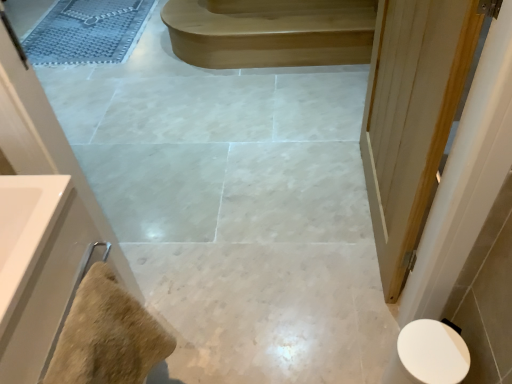
Question: Is white glossy sink at left to the left or to the right of light brown wood stair at upper center in the image?

Choices:
 (A) right
 (B) left

Answer: (B)

Question: From a real-world perspective, is white glossy sink at left physically located above or below light brown wood stair at upper center?

Choices:
 (A) below
 (B) above

Answer: (B)

Question: Based on their relative distances, which object is farther from the textured gray bath mat at upper left?

Choices:
 (A) light brown wood stair at upper center
 (B) beige textured towel at lower left
 (C) white glossy toilet at lower right
 (D) white wood door at right
 (E) white glossy sink at left

Answer: (C)

Question: Which object is the farthest from the light brown wood stair at upper center?

Choices:
 (A) white glossy sink at left
 (B) white wood door at right
 (C) textured gray bath mat at upper left
 (D) white glossy toilet at lower right
 (E) beige textured towel at lower left

Answer: (E)